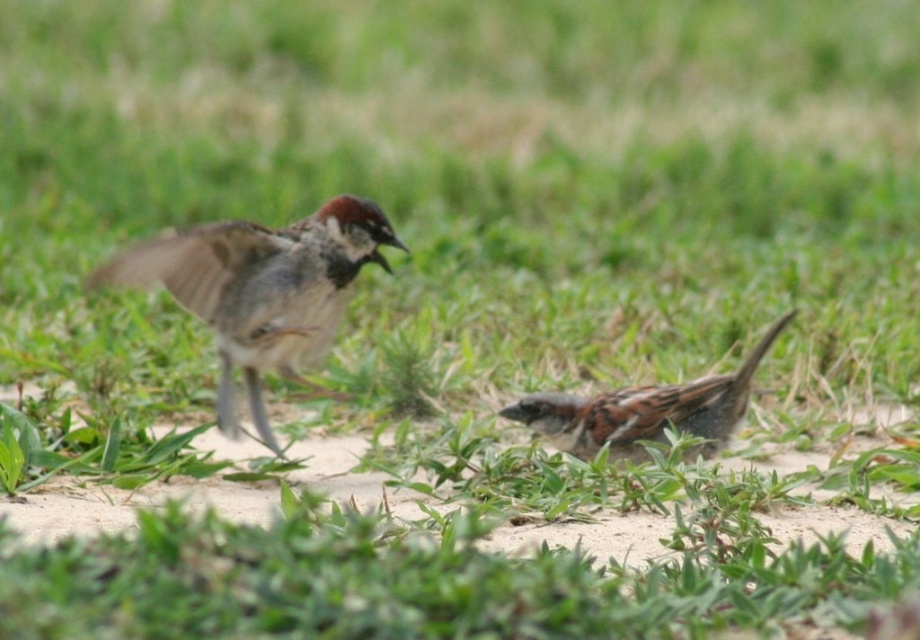
Question: Among these objects, which one is nearest to the camera?

Choices:
 (A) brown feathered sparrow at left
 (B) brown speckled sparrow at lower right

Answer: (A)

Question: Does brown feathered sparrow at left have a larger size compared to brown speckled sparrow at lower right?

Choices:
 (A) no
 (B) yes

Answer: (B)

Question: Which of the following is the farthest from the observer?

Choices:
 (A) brown feathered sparrow at left
 (B) brown speckled sparrow at lower right

Answer: (B)

Question: Can you confirm if brown feathered sparrow at left is positioned to the left of brown speckled sparrow at lower right?

Choices:
 (A) yes
 (B) no

Answer: (A)

Question: Can you confirm if brown feathered sparrow at left is bigger than brown speckled sparrow at lower right?

Choices:
 (A) no
 (B) yes

Answer: (B)